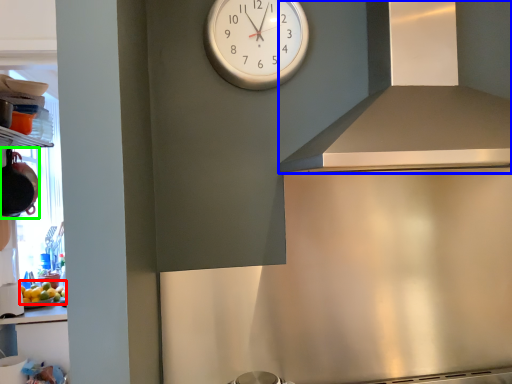
Question: Which object is the farthest from food (highlighted by a red box)? Choose among these: exhaust hood (highlighted by a blue box) or appliance (highlighted by a green box).

Choices:
 (A) exhaust hood
 (B) appliance

Answer: (A)